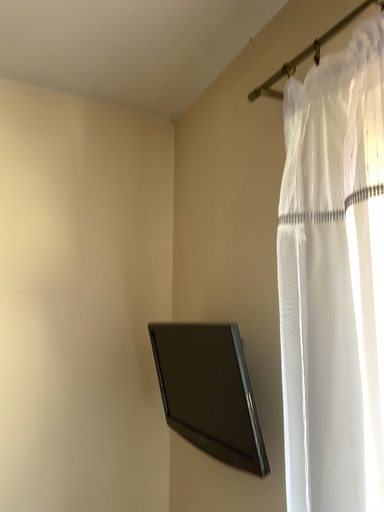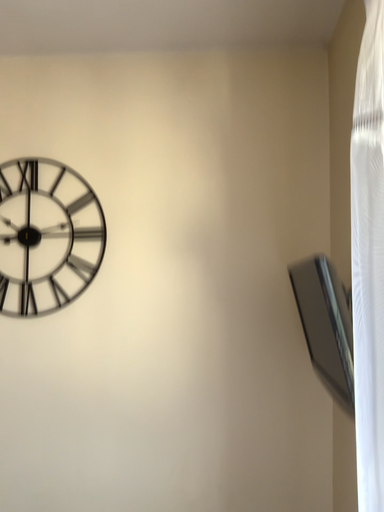
Question: How did the camera likely rotate when shooting the video?

Choices:
 (A) rotated left
 (B) rotated right

Answer: (A)